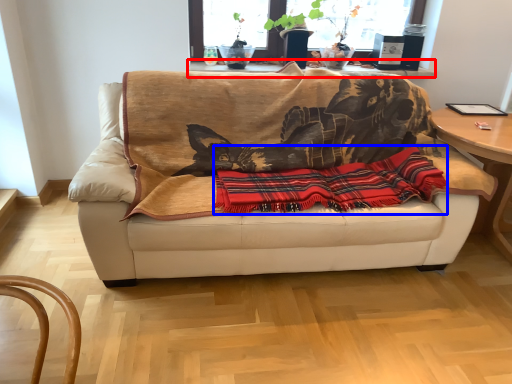
Question: Which of the following is the closest to the observer, table (highlighted by a red box) or plaid (highlighted by a blue box)?

Choices:
 (A) table
 (B) plaid

Answer: (B)